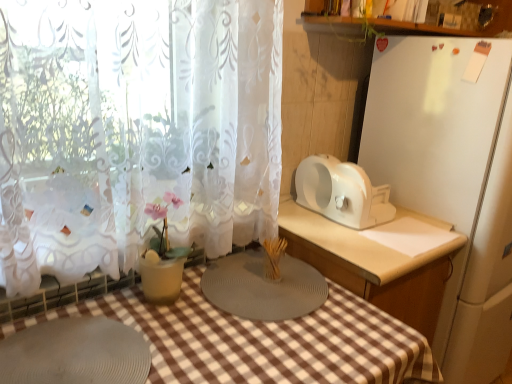
Question: From a real-world perspective, is gray rubber mat at lower left above or below white plastic toaster at right, which is the 1th appliance from right to left?

Choices:
 (A) below
 (B) above

Answer: (B)

Question: Looking at the image, does gray rubber mat at lower left seem bigger or smaller compared to white plastic toaster at right, which is the 1th appliance from right to left?

Choices:
 (A) small
 (B) big

Answer: (A)

Question: Estimate the real-world distances between objects in this image. Which object is farther from the white lace curtain at left?

Choices:
 (A) gray rubber mat at lower left
 (B) white plastic toaster at right, marked as the 3th appliance in a left-to-right arrangement
 (C) white plastic toaster at right, positioned as the 2th appliance in left-to-right order
 (D) gray rubber placemat at center, which is the first appliance in left-to-right order

Answer: (B)

Question: Which is nearer to the gray rubber mat at lower left?

Choices:
 (A) gray rubber placemat at center, placed as the third appliance when sorted from right to left
 (B) white lace curtain at left
 (C) white plastic toaster at right, the second appliance when ordered from right to left
 (D) white plastic toaster at right, which is the 1th appliance from right to left

Answer: (A)